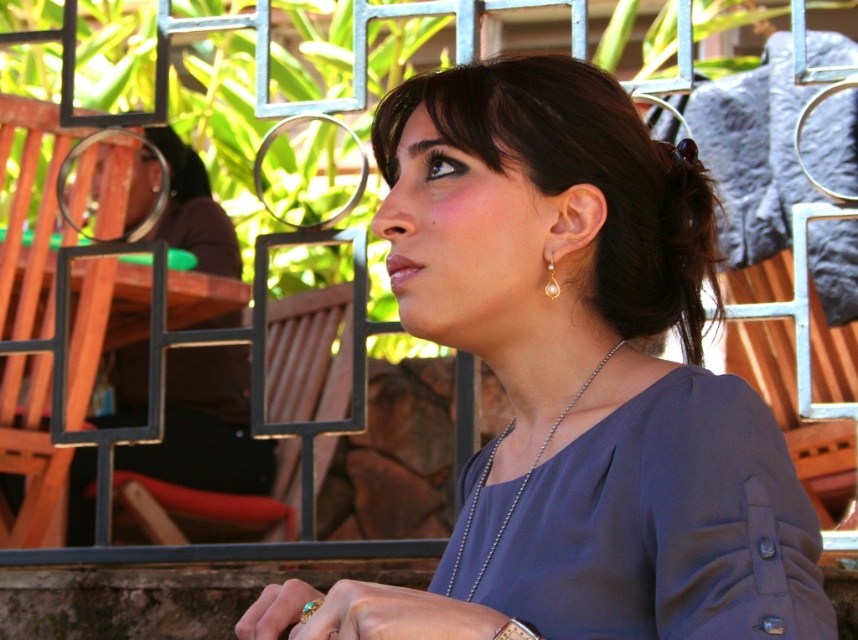
You are a photographer trying to capture a closeup of the matte purple blouse at center and matte blue dress at center. Can you fit both items into your camera frame if the maximum width your camera can capture is 3 inches?

The distance between the matte purple blouse at center and matte blue dress at center is 3.28 inches, which exceeds the camera frame width of 3 inches. Therefore, both items cannot be captured in a single frame.

You are a photographer standing at the edge of the scene. You need to capture a photo that includes both the matte blue dress at center and the metallic wood chair at center in the same frame. Based on their positions, do you think you can fit both objects into your camera viewfinder without moving your position?

The matte blue dress at center and the metallic wood chair at center are 5.08 meters apart. Since they are positioned at a distance from each other but both located at the center of the scene, it is likely possible to include both in the camera viewfinder without moving your position, provided the camera has an appropriate focal length and angle of view.